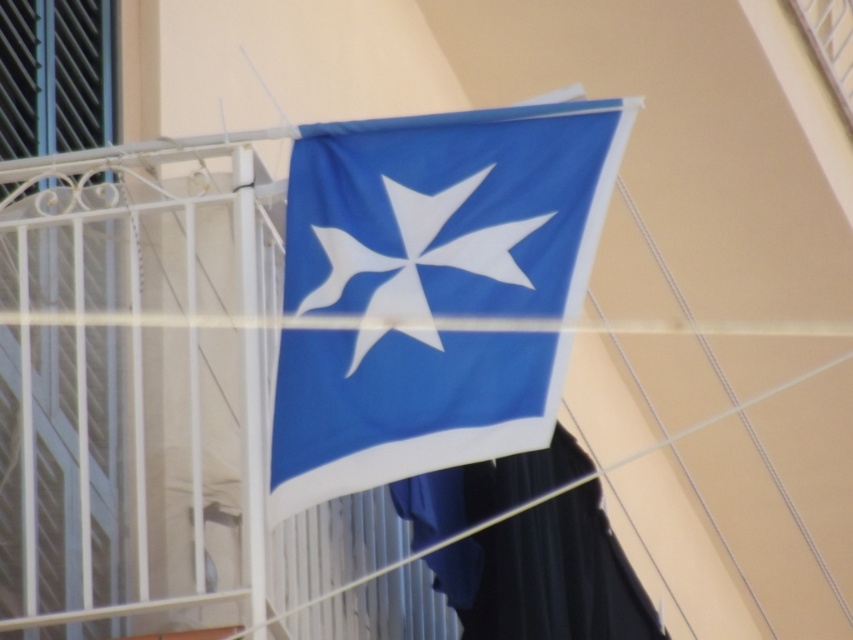
Question: Which of the following is the closest to the observer?

Choices:
 (A) white fabric star at center
 (B) blue fabric flag at center

Answer: (A)

Question: Among these objects, which one is farthest from the camera?

Choices:
 (A) blue fabric flag at center
 (B) white fabric star at center

Answer: (A)

Question: Is blue fabric flag at center thinner than white fabric star at center?

Choices:
 (A) yes
 (B) no

Answer: (A)

Question: Does blue fabric flag at center have a lesser width compared to white fabric star at center?

Choices:
 (A) yes
 (B) no

Answer: (A)

Question: Which of the following is the closest to the observer?

Choices:
 (A) white fabric star at center
 (B) blue fabric flag at center

Answer: (A)

Question: Does blue fabric flag at center have a lesser width compared to white fabric star at center?

Choices:
 (A) yes
 (B) no

Answer: (A)